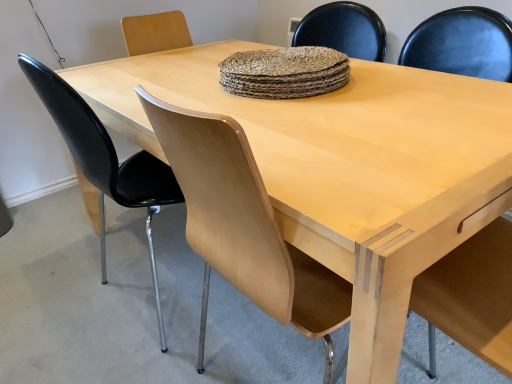
Question: Considering the relative sizes of black glossy chair at left, the 2th chair when ordered from right to left, and light wood armchair at right in the image provided, is black glossy chair at left, the 2th chair when ordered from right to left, thinner than light wood armchair at right?

Choices:
 (A) no
 (B) yes

Answer: (A)

Question: Is black glossy chair at left, the 1th chair when ordered from left to right, in contact with light wood armchair at right?

Choices:
 (A) yes
 (B) no

Answer: (B)

Question: Considering the relative positions of black glossy chair at left, the 2th chair when ordered from right to left, and light wood armchair at right in the image provided, is black glossy chair at left, the 2th chair when ordered from right to left, to the left of light wood armchair at right from the viewer's perspective?

Choices:
 (A) yes
 (B) no

Answer: (A)

Question: Considering the relative positions of black glossy chair at left, the 1th chair when ordered from left to right, and light wood armchair at right in the image provided, is black glossy chair at left, the 1th chair when ordered from left to right, to the right of light wood armchair at right from the viewer's perspective?

Choices:
 (A) no
 (B) yes

Answer: (A)

Question: Is black glossy chair at left, the 2th chair when ordered from right to left, wider than light wood armchair at right?

Choices:
 (A) yes
 (B) no

Answer: (A)

Question: In terms of size, does black glossy chair at left, the 2th chair when ordered from right to left, appear bigger or smaller than light wood chair at center, the 1th chair when ordered from right to left?

Choices:
 (A) small
 (B) big

Answer: (A)

Question: From their relative heights in the image, would you say black glossy chair at left, the 2th chair when ordered from right to left, is taller or shorter than light wood chair at center, the second chair in the left-to-right sequence?

Choices:
 (A) tall
 (B) short

Answer: (B)

Question: Considering the positions of point (48, 74) and point (198, 241), is point (48, 74) closer or farther from the camera than point (198, 241)?

Choices:
 (A) farther
 (B) closer

Answer: (A)

Question: Do you think black glossy chair at left, the 2th chair when ordered from right to left, is within light wood chair at center, the second chair in the left-to-right sequence, or outside of it?

Choices:
 (A) inside
 (B) outside

Answer: (B)

Question: Considering the positions of black glossy chair at left, the 2th chair when ordered from right to left, and light wood armchair at right in the image, is black glossy chair at left, the 2th chair when ordered from right to left, bigger or smaller than light wood armchair at right?

Choices:
 (A) big
 (B) small

Answer: (A)

Question: Is black glossy chair at left, the 2th chair when ordered from right to left, to the left or to the right of light wood armchair at right in the image?

Choices:
 (A) left
 (B) right

Answer: (A)

Question: Does point [37, 92] appear closer or farther from the camera than point [460, 269]?

Choices:
 (A) closer
 (B) farther

Answer: (B)

Question: From the image's perspective, is black glossy chair at left, the 2th chair when ordered from right to left, positioned above or below light wood armchair at right?

Choices:
 (A) below
 (B) above

Answer: (B)

Question: From their relative heights in the image, would you say light wood chair at center, the second chair in the left-to-right sequence, is taller or shorter than black glossy chair at left, the 2th chair when ordered from right to left?

Choices:
 (A) tall
 (B) short

Answer: (A)

Question: In the image, is light wood chair at center, the 1th chair when ordered from right to left, positioned in front of or behind black glossy chair at left, the 2th chair when ordered from right to left?

Choices:
 (A) front
 (B) behind

Answer: (A)